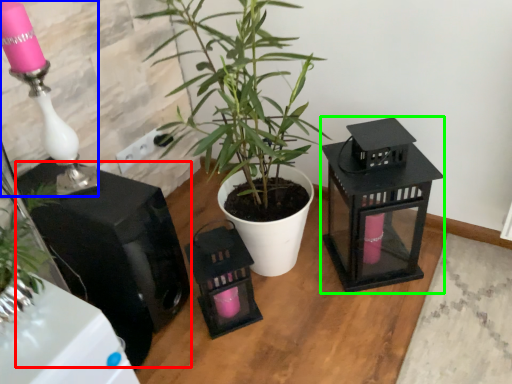
Question: Estimate the real-world distances between objects in this image. Which object is farther from appliance (highlighted by a red box), table lamp (highlighted by a blue box) or appliance (highlighted by a green box)?

Choices:
 (A) table lamp
 (B) appliance

Answer: (B)